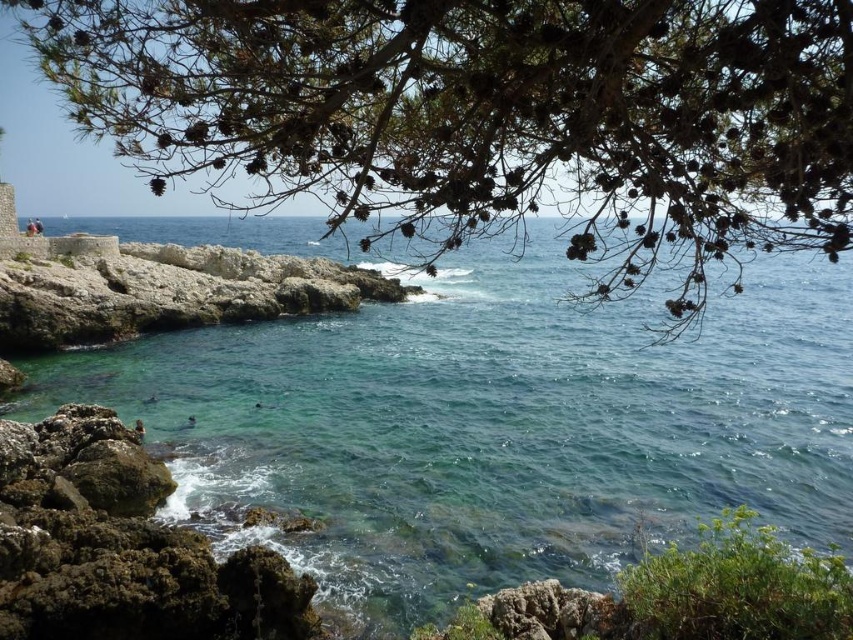
Is green textured pine branches at upper center to the right of rough stone wall at left from the viewer's perspective?

Correct, you'll find green textured pine branches at upper center to the right of rough stone wall at left.

Does point (656, 220) come farther from viewer compared to point (169, 264)?

No, it is in front of (169, 264).

Locate an element on the screen. green textured pine branches at upper center is located at coordinates (486, 115).

Who is more distant from viewer, (461, 260) or (45, 497)?

Point (461, 260)

Can you confirm if clear water at center is wider than green mossy rock at lower left?

Yes.

At what (x,y) coordinates should I click in order to perform the action: click on clear water at center. Please return your answer as a coordinate pair (x, y). Looking at the image, I should click on (494, 424).

Is green mossy rock at lower left further to camera compared to rough stone wall at left?

No, green mossy rock at lower left is closer to the viewer.

Is green mossy rock at lower left shorter than rough stone wall at left?

Yes.

Which is in front, point (148, 499) or point (45, 328)?

Point (148, 499)

Identify the location of green mossy rock at lower left. The height and width of the screenshot is (640, 853). (120, 547).